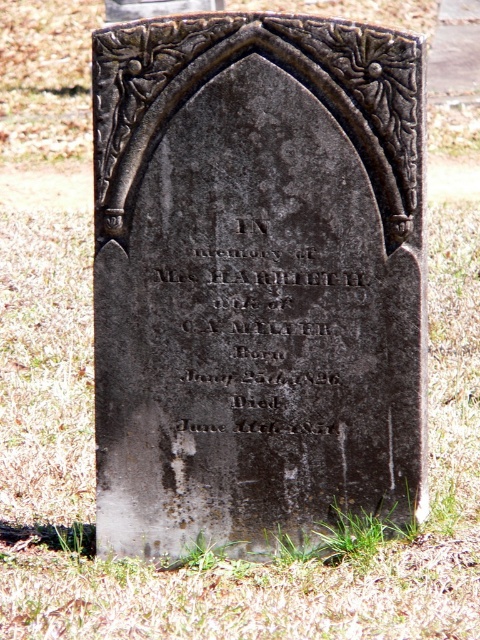
You are standing in a cemetery and see the gray stone gravestone at center and the green grass at center. Which object is taller?

The gray stone gravestone at center is much taller than the green grass at center.

Consider the image. You are a historian examining the gray stone gravestone at center and the black stone inscription at center. Which object is wider?

The gray stone gravestone at center is wider than the black stone inscription at center.

You are standing at point 0.5, 0.5 in the cemetery. You want to visit the gray stone gravestone at center. In which direction should you move to reach it?

The gray stone gravestone at center is located at point (255, 278). Since you are at point (240, 320), you should move slightly to the left and forward to reach it.